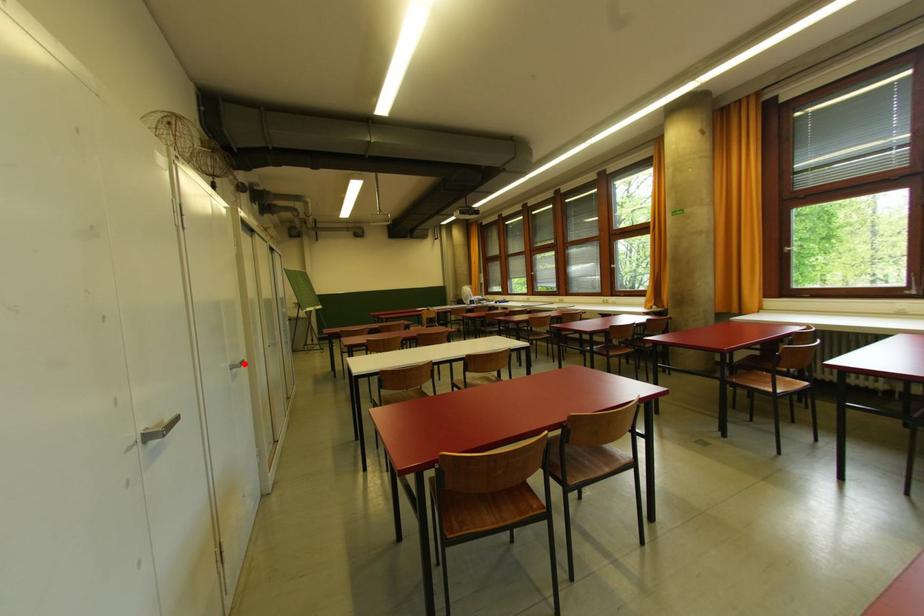
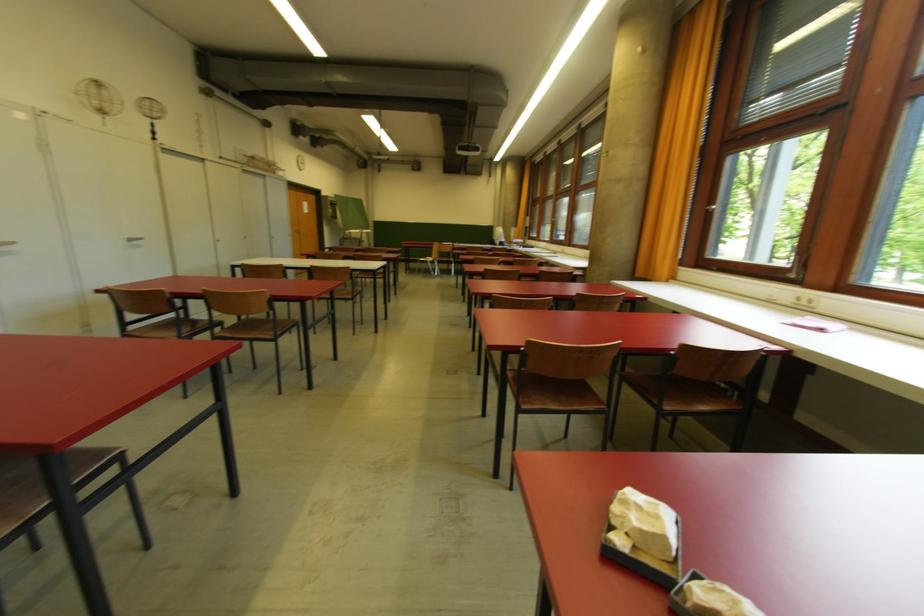
Where in the second image is the point corresponding to the highlighted location from the first image?

(144, 241)